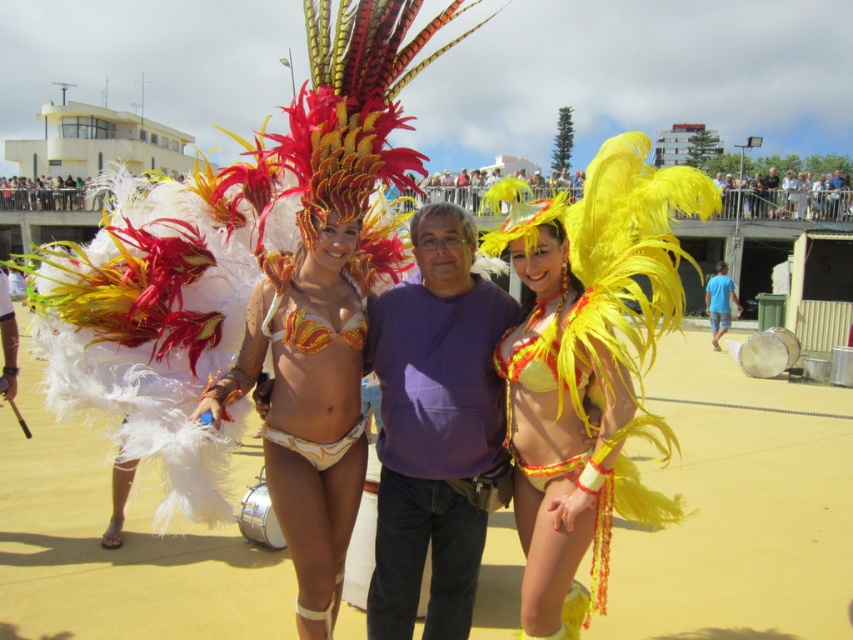
Can you confirm if shiny sequined bikini top at center is positioned to the left of yellow feathered bikini at center?

Indeed, shiny sequined bikini top at center is positioned on the left side of yellow feathered bikini at center.

This screenshot has width=853, height=640. What do you see at coordinates (308, 410) in the screenshot? I see `shiny sequined bikini top at center` at bounding box center [308, 410].

You are a GUI agent. You are given a task and a screenshot of the screen. Output one action in this format:
    pyautogui.click(x=<x>, y=<y>)
    Task: Click on the shiny sequined bikini top at center
    
    Given the screenshot: What is the action you would take?
    pyautogui.click(x=308, y=410)